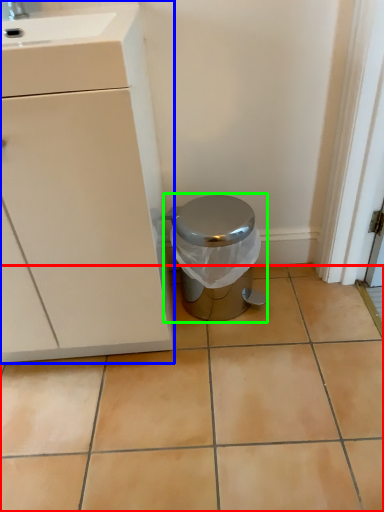
Question: Which object is the closest to the ceramic tile (highlighted by a red box)? Choose among these: cabinetry (highlighted by a blue box) or waste container (highlighted by a green box).

Choices:
 (A) cabinetry
 (B) waste container

Answer: (B)